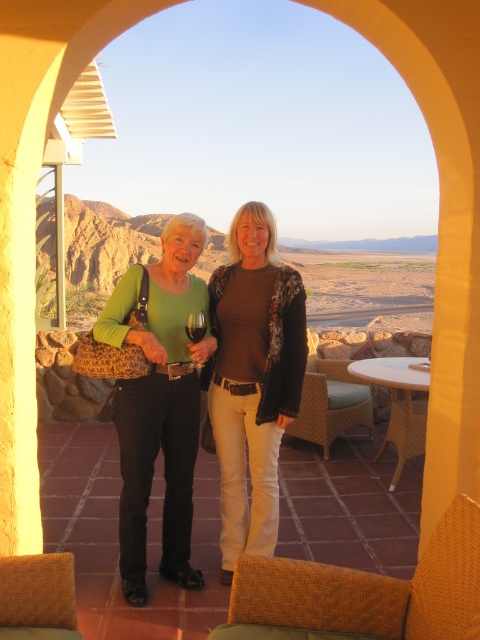
You are a bartender preparing drinks for a party. You have a transparent glass at center and a translucent glass wine at center on the counter. You need to place them in a box that can only hold items 0.5 inches apart. Can both items fit in the box?

The transparent glass at center and translucent glass wine at center are 0.48 inches apart, so they can fit in the box since the distance between them is less than the box capacity of 0.5 inches.